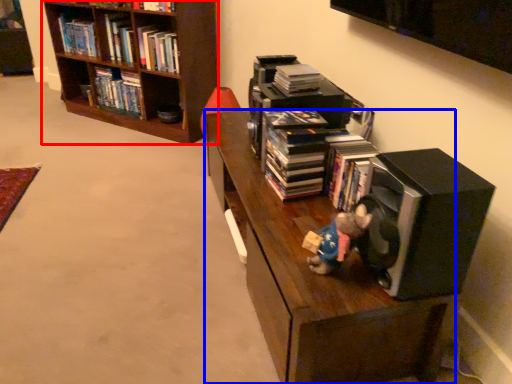
Question: Among these objects, which one is farthest to the camera, bookcase (highlighted by a red box) or shelf (highlighted by a blue box)?

Choices:
 (A) bookcase
 (B) shelf

Answer: (A)